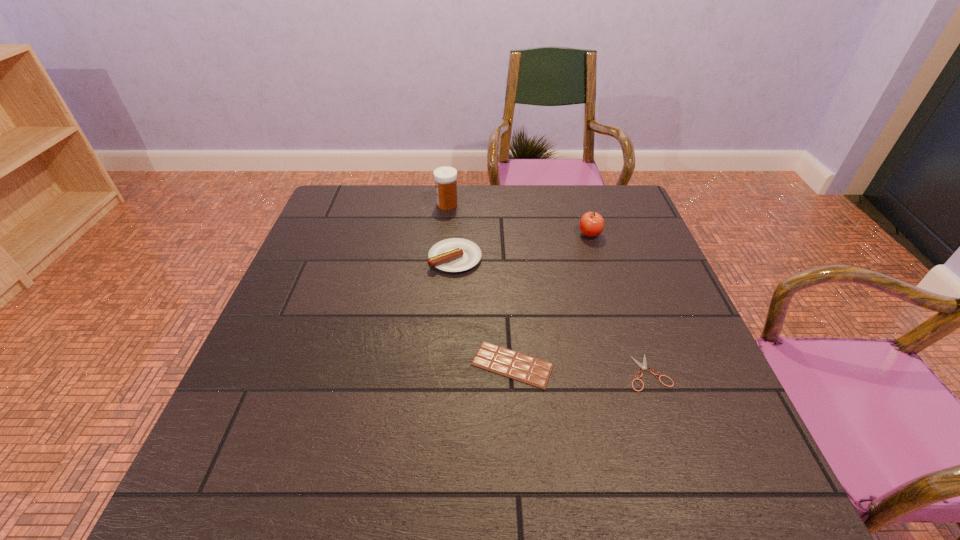
Find the location of a particular element. blank space located on the front of the third tallest object is located at coordinates (451, 312).

At what (x,y) coordinates should I click in order to perform the action: click on free space located 0.350m on the left of the fourth tallest object. Please return your answer as a coordinate pair (x, y). The image size is (960, 540). Looking at the image, I should click on (308, 364).

Identify the location of vacant area situated on the back of the shortest object. Image resolution: width=960 pixels, height=540 pixels. [611, 261].

Locate an element on the screen. object present at the far edge is located at coordinates (445, 177).

Identify the location of apple that is at the right edge. (591, 224).

The height and width of the screenshot is (540, 960). I want to click on shears that is at the right edge, so [643, 366].

In the image, there is a desktop. At what (x,y) coordinates should I click in order to perform the action: click on free region at the far edge. Please return your answer as a coordinate pair (x, y). This screenshot has height=540, width=960. Looking at the image, I should click on (523, 226).

The width and height of the screenshot is (960, 540). What are the coordinates of `vacant space at the near edge of the desktop` in the screenshot? It's located at (657, 498).

Find the location of a particular element. This screenshot has height=540, width=960. free space at the left edge of the desktop is located at coordinates 266,380.

In order to click on vacant space at the right edge in this screenshot , I will do click(621, 254).